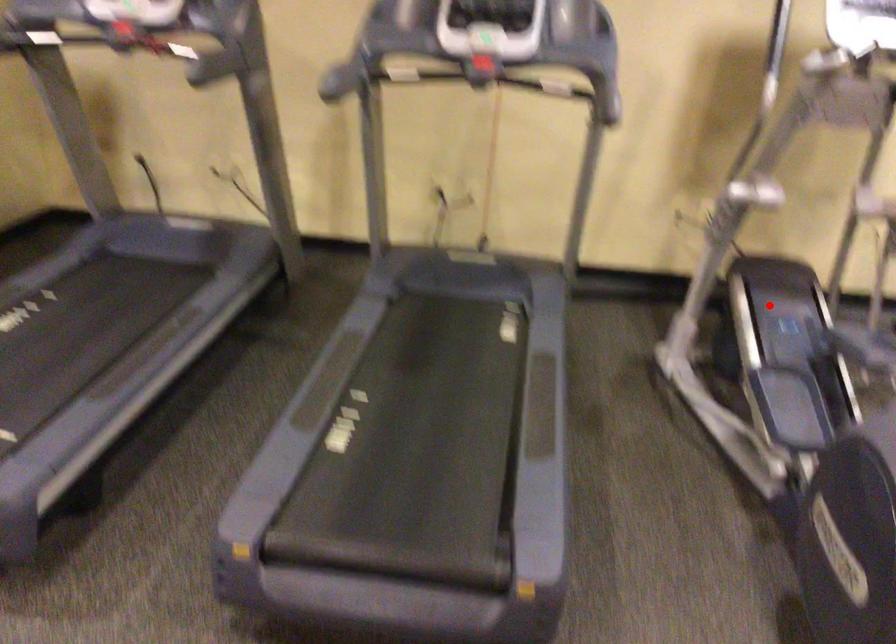
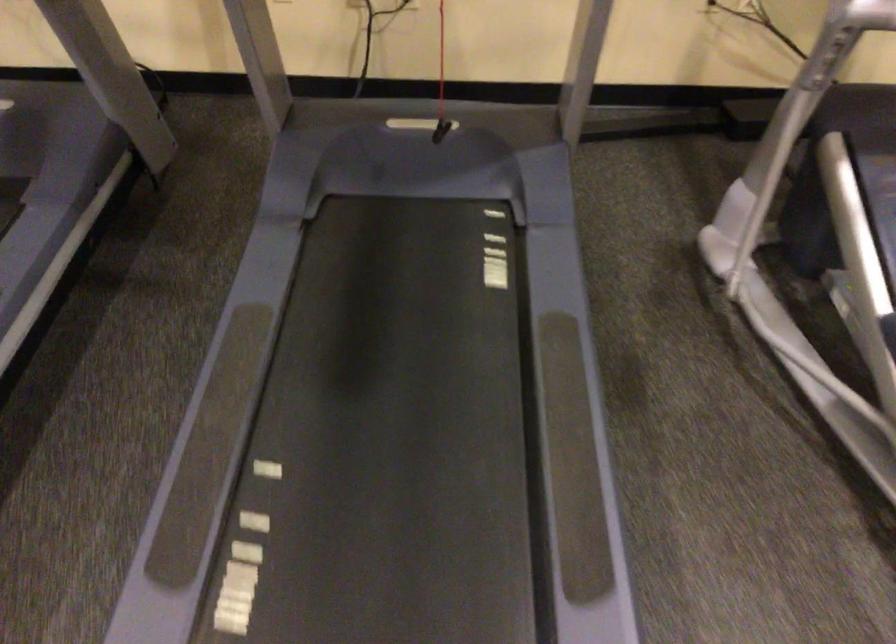
Locate, in the second image, the point that corresponds to the highlighted location in the first image.

(876, 190)